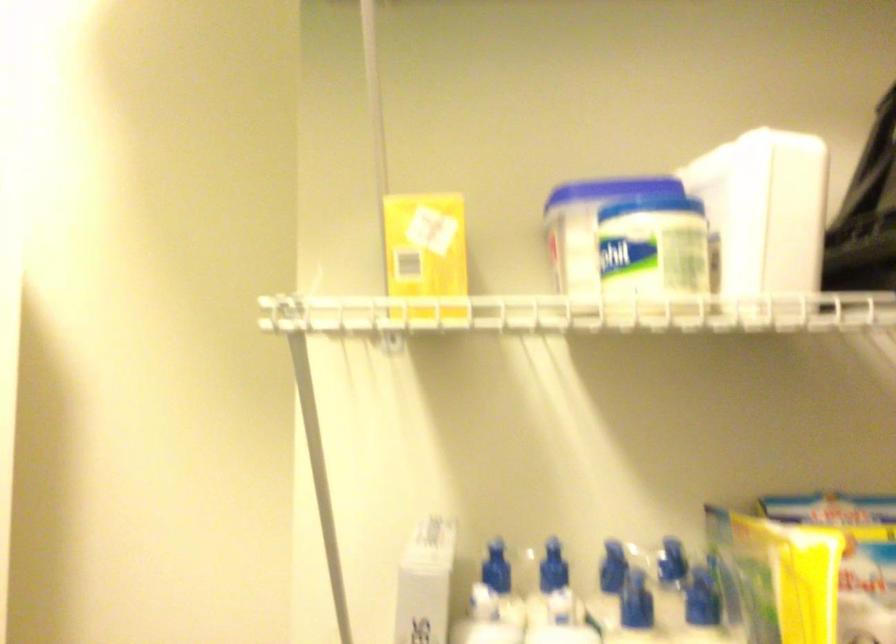
Question: The camera is either moving clockwise (left) or counter-clockwise (right) around the object. The first image is from the beginning of the video and the second image is from the end. Is the camera moving left or right when shooting the video?

Choices:
 (A) Left
 (B) Right

Answer: (B)